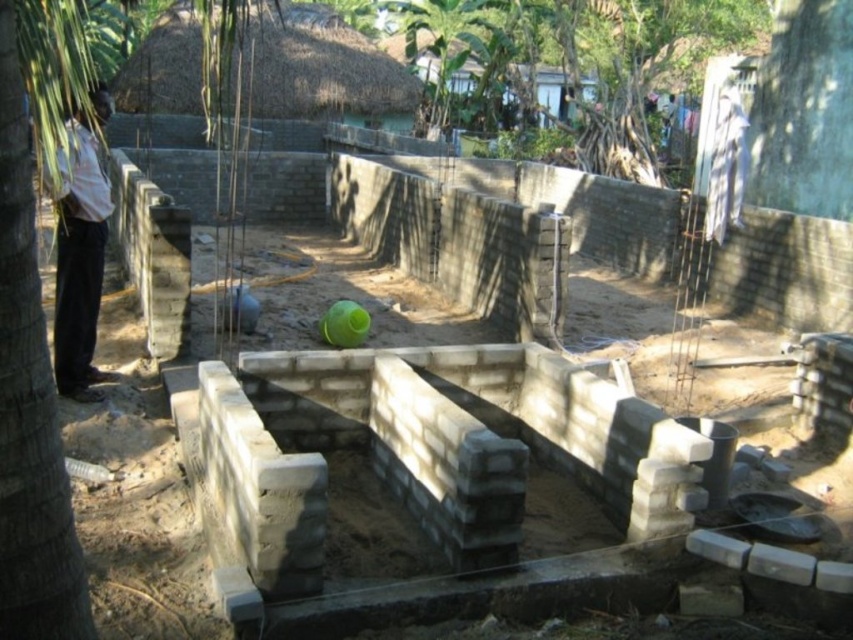
You are a construction worker who needs to place a new brick on the gray concrete foundation at center. Considering the size of the green leafy tree at left, will the brick fit on the foundation?

The gray concrete foundation at center is larger in size than the green leafy tree at left, so the brick will fit on the foundation since it is bigger than the tree.

You are a construction worker who needs to place a heavy equipment on the gray concrete foundation at center without damaging the green leafy tree at left. Based on their positions, which direction should you move the equipment to ensure it stays clear of the tree?

The gray concrete foundation at center is to the right of the green leafy tree at left. To avoid damaging the tree, you should move the equipment further to the right away from the green leafy tree at left.

You are standing at the center of the construction site. You need to move to the green leafy tree at left. Which direction should you move in?

Since the green leafy tree at left is located at point (x=33, y=330), you should move to the left direction to reach it.